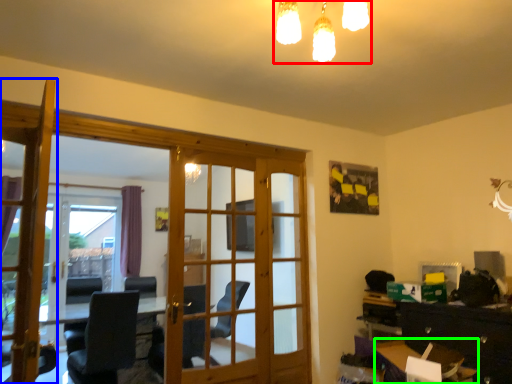
Question: Which object is positioned farthest from light fixture (highlighted by a red box)? Select from door (highlighted by a blue box) and table (highlighted by a green box).

Choices:
 (A) door
 (B) table

Answer: (B)